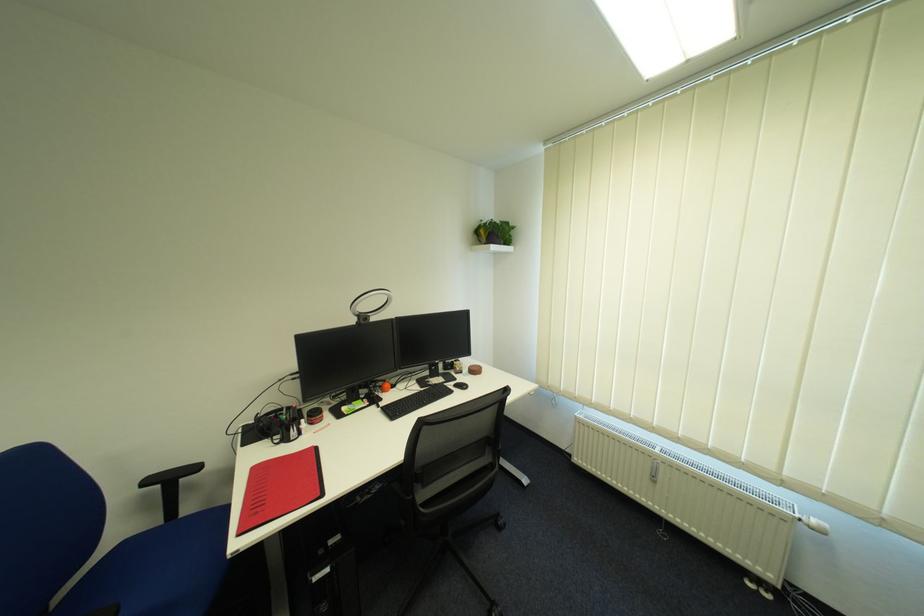
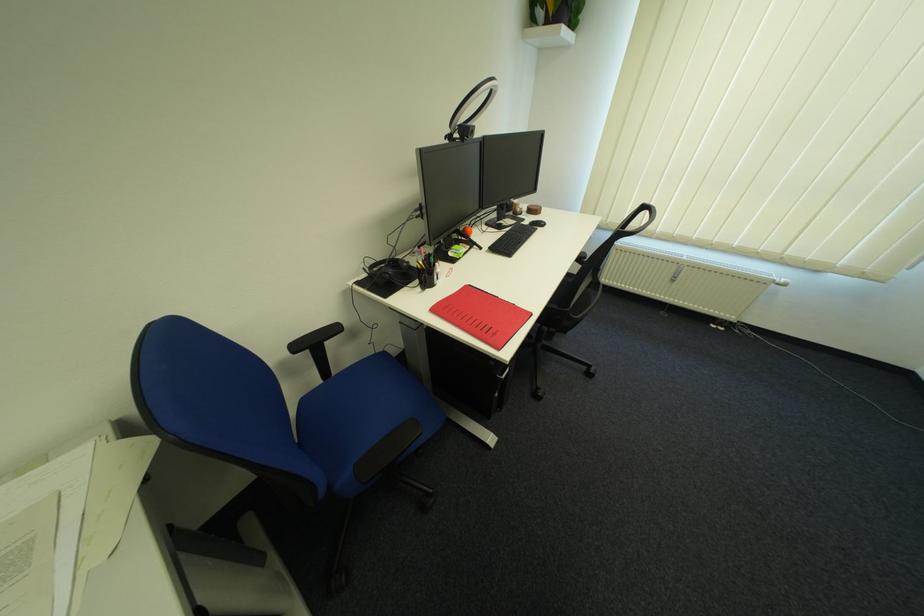
In the second image, find the point that corresponds to (x=823, y=523) in the first image.

(793, 281)